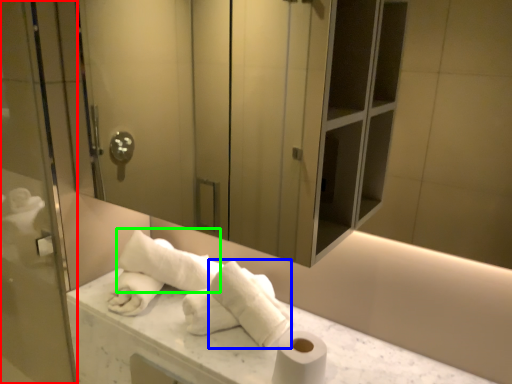
Question: Considering the real-world distances, which object is closest to screen door (highlighted by a red box)? bath towel (highlighted by a blue box) or bath towel (highlighted by a green box).

Choices:
 (A) bath towel
 (B) bath towel

Answer: (B)